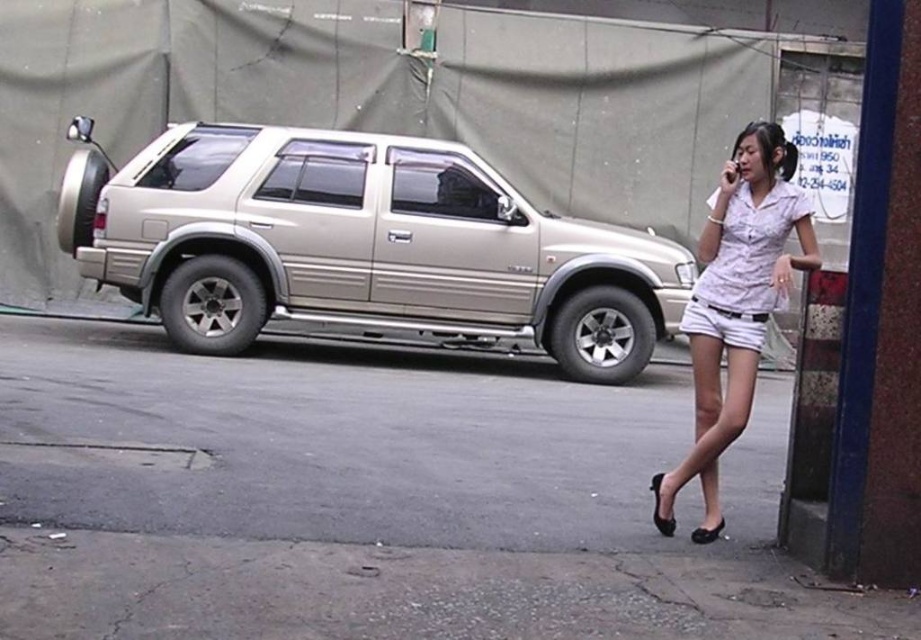
Who is positioned more to the left, white matte shorts at lower right or white cotton shorts at center?

white cotton shorts at center is more to the left.

Is point (657, 508) positioned in front of point (749, 337)?

No, it is not.

Is point (731, 192) closer to camera compared to point (692, 308)?

That is True.

I want to click on white matte shorts at lower right, so click(x=735, y=305).

Is gray asphalt pavement at lower center taller than metallic gold minivan at left?

In fact, gray asphalt pavement at lower center may be shorter than metallic gold minivan at left.

Does point (562, 572) come behind point (409, 310)?

No, (562, 572) is closer to viewer.

Identify the location of gray asphalt pavement at lower center. (374, 502).

Consider the image. Who is more forward, (453, 316) or (723, 314)?

Positioned in front is point (723, 314).

Is metallic gold minivan at left wider than white cotton shorts at center?

Yes.

Who is more forward, (155, 307) or (682, 321)?

Positioned in front is point (682, 321).

This screenshot has height=640, width=921. What are the coordinates of `metallic gold minivan at left` in the screenshot? It's located at (363, 246).